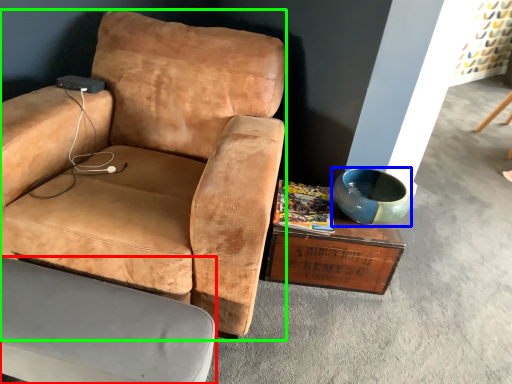
Question: Which object is positioned farthest from chair (highlighted by a red box)? Select from bowl (highlighted by a blue box) and chair (highlighted by a green box).

Choices:
 (A) bowl
 (B) chair

Answer: (A)